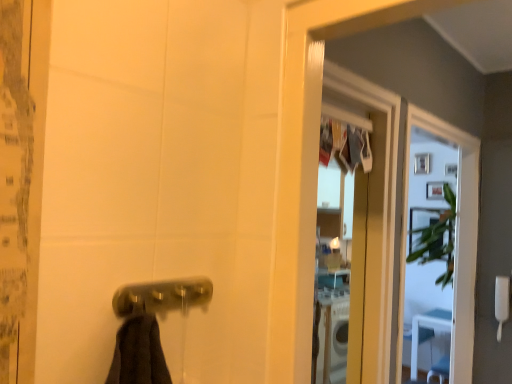
What is the approximate height of polished brass door handle at lower center?

The height of polished brass door handle at lower center is 2.27 inches.

Where is `polished brass door handle at lower center`? This screenshot has width=512, height=384. polished brass door handle at lower center is located at coordinates (162, 296).

What is the approximate height of clear glass screen door at upper right?

clear glass screen door at upper right is 1.34 meters tall.

Where is `polished brass door handle at lower center`? polished brass door handle at lower center is located at coordinates (162, 296).

What's the angular difference between white plastic towel bar at lower left and polished brass door handle at lower center's facing directions?

The facing directions of white plastic towel bar at lower left and polished brass door handle at lower center are 89.1 degrees apart.

Does point (502, 302) come closer to viewer compared to point (202, 276)?

No, (502, 302) is further to viewer.

From the image's perspective, is white plastic towel bar at lower left positioned above or below polished brass door handle at lower center?

From the image's perspective, white plastic towel bar at lower left appears below polished brass door handle at lower center.

How distant is clear glass screen door at upper right from white plastic towel bar at lower left?

A distance of 16.31 inches exists between clear glass screen door at upper right and white plastic towel bar at lower left.

Is clear glass screen door at upper right positioned with its back to white plastic towel bar at lower left?

No, white plastic towel bar at lower left is not at the back of clear glass screen door at upper right.

Would you say clear glass screen door at upper right is outside white plastic towel bar at lower left?

Yes.

Considering the points (462, 359) and (504, 283), which point is in front, point (462, 359) or point (504, 283)?

The point (504, 283) is closer to the camera.

Considering the relative sizes of white plastic towel bar at lower left and clear glass screen door at upper right in the image provided, is white plastic towel bar at lower left taller than clear glass screen door at upper right?

Incorrect, the height of white plastic towel bar at lower left is not larger of that of clear glass screen door at upper right.

From a real-world perspective, who is located lower, white plastic towel bar at lower left or clear glass screen door at upper right?

white plastic towel bar at lower left is physically lower.

Is white plastic towel bar at lower left positioned with its back to clear glass screen door at upper right?

white plastic towel bar at lower left is not turned away from clear glass screen door at upper right.

From the picture: From the image's perspective, relative to clear glass screen door at upper right, is white plastic towel bar at lower left above or below?

white plastic towel bar at lower left is situated lower than clear glass screen door at upper right in the image.

From a real-world perspective, relative to clear glass screen door at upper right, is polished brass door handle at lower center vertically above or below?

polished brass door handle at lower center is situated higher than clear glass screen door at upper right in the real world.

Who is shorter, polished brass door handle at lower center or clear glass screen door at upper right?

Standing shorter between the two is polished brass door handle at lower center.

Does polished brass door handle at lower center contain clear glass screen door at upper right?

No, polished brass door handle at lower center does not contain clear glass screen door at upper right.

Does polished brass door handle at lower center appear on the right side of clear glass screen door at upper right?

No, polished brass door handle at lower center is not to the right of clear glass screen door at upper right.

Considering the sizes of objects polished brass door handle at lower center and white plastic towel bar at lower left in the image provided, who is smaller, polished brass door handle at lower center or white plastic towel bar at lower left?

With smaller size is polished brass door handle at lower center.

Is polished brass door handle at lower center positioned with its back to white plastic towel bar at lower left?

No.

Between polished brass door handle at lower center and white plastic towel bar at lower left, which one is positioned behind?

white plastic towel bar at lower left.

Looking at the image, does clear glass screen door at upper right seem bigger or smaller compared to polished brass door handle at lower center?

Clearly, clear glass screen door at upper right is larger in size than polished brass door handle at lower center.

Between point (472, 155) and point (157, 290), which one is positioned behind?

The point (472, 155) is more distant.

From the image's perspective, which one is positioned higher, clear glass screen door at upper right or polished brass door handle at lower center?

polished brass door handle at lower center appears higher in the image.

Identify the location of towel bar below the polished brass door handle at lower center (from the image's perspective). The height and width of the screenshot is (384, 512). (502, 302).

You are a GUI agent. You are given a task and a screenshot of the screen. Output one action in this format:
    pyautogui.click(x=<x>, y=<y>)
    Task: Click on the towel bar lying on the right of clear glass screen door at upper right
    The width and height of the screenshot is (512, 384).
    Given the screenshot: What is the action you would take?
    pyautogui.click(x=502, y=302)

Estimate the real-world distances between objects in this image. Which object is further from white plastic towel bar at lower left, polished brass door handle at lower center or clear glass screen door at upper right?

Among the two, polished brass door handle at lower center is located further to white plastic towel bar at lower left.

When comparing their distances from clear glass screen door at upper right, does white plastic towel bar at lower left or polished brass door handle at lower center seem further?

Based on the image, polished brass door handle at lower center appears to be further to clear glass screen door at upper right.

In the scene shown: Looking at the image, which one is located closer to polished brass door handle at lower center, white plastic towel bar at lower left or clear glass screen door at upper right?

clear glass screen door at upper right.

From the image, which object appears to be farther from white plastic towel bar at lower left, clear glass screen door at upper right or polished brass door handle at lower center?

polished brass door handle at lower center is further to white plastic towel bar at lower left.

Looking at the image, which one is located closer to polished brass door handle at lower center, clear glass screen door at upper right or white plastic towel bar at lower left?

clear glass screen door at upper right lies closer to polished brass door handle at lower center than the other object.

Estimate the real-world distances between objects in this image. Which object is closer to clear glass screen door at upper right, polished brass door handle at lower center or white plastic towel bar at lower left?

Based on the image, white plastic towel bar at lower left appears to be nearer to clear glass screen door at upper right.

Find the location of `screen door between polished brass door handle at lower center and white plastic towel bar at lower left along the z-axis`. screen door between polished brass door handle at lower center and white plastic towel bar at lower left along the z-axis is located at coordinates (456, 239).